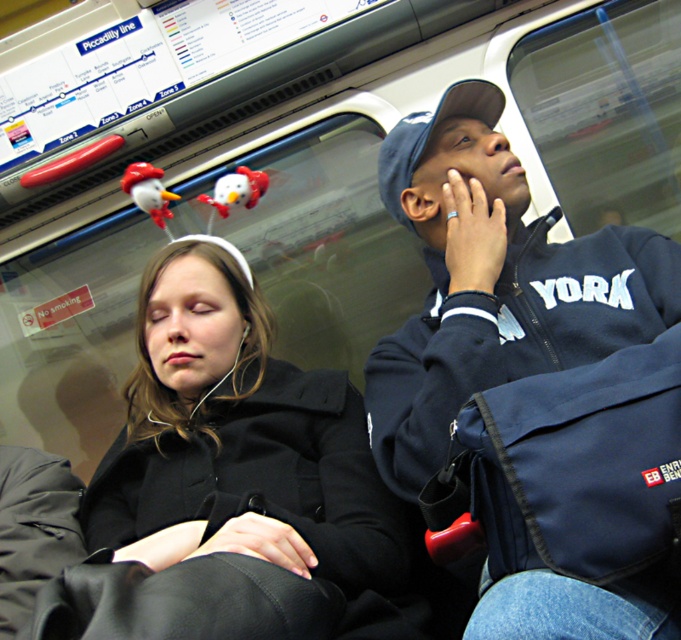
Question: Is black matte coat at center to the right of navy blue jacket at upper right from the viewer's perspective?

Choices:
 (A) no
 (B) yes

Answer: (A)

Question: Is black matte coat at center wider than navy blue jacket at upper right?

Choices:
 (A) yes
 (B) no

Answer: (A)

Question: Which point appears farthest from the camera in this image?

Choices:
 (A) (347, 609)
 (B) (477, 118)

Answer: (B)

Question: Does black matte coat at center have a larger size compared to navy blue jacket at upper right?

Choices:
 (A) yes
 (B) no

Answer: (A)

Question: Which object appears farthest from the camera in this image?

Choices:
 (A) navy blue jacket at upper right
 (B) black matte coat at center

Answer: (A)

Question: Among these points, which one is nearest to the camera?

Choices:
 (A) (537, 355)
 (B) (257, 461)

Answer: (A)